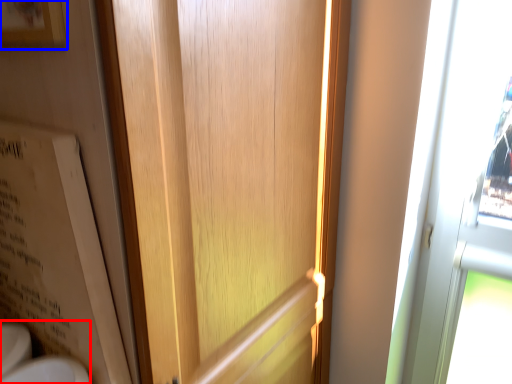
Question: Which object is further to the camera taking this photo, sink (highlighted by a red box) or picture frame (highlighted by a blue box)?

Choices:
 (A) sink
 (B) picture frame

Answer: (A)